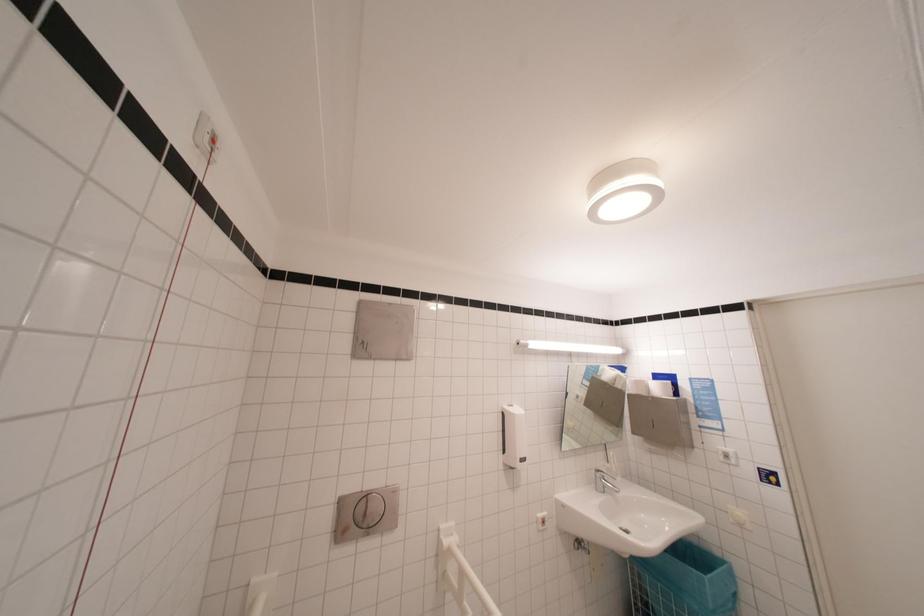
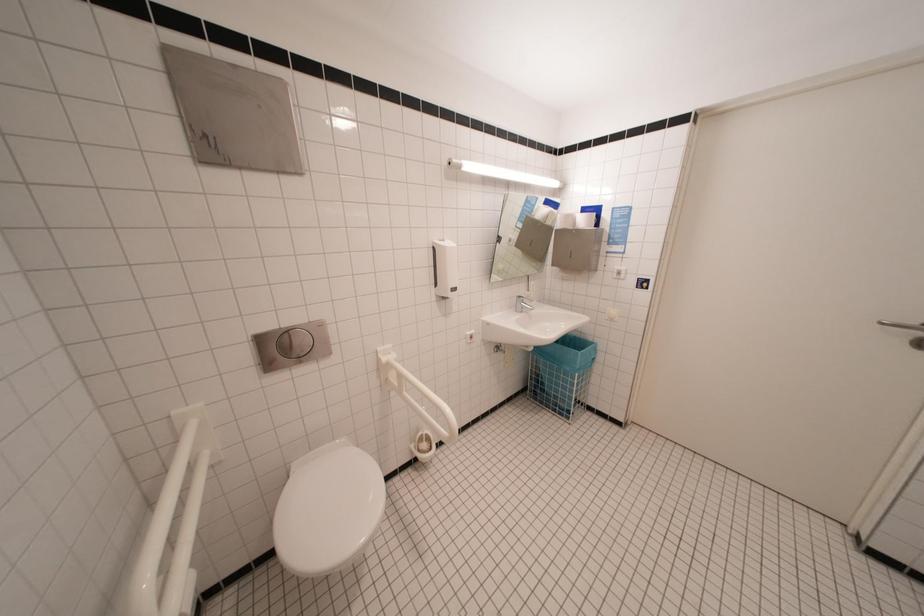
Question: The first image is from the beginning of the video and the second image is from the end. How did the camera likely rotate when shooting the video?

Choices:
 (A) Left
 (B) Right
 (C) Up
 (D) Down

Answer: (D)